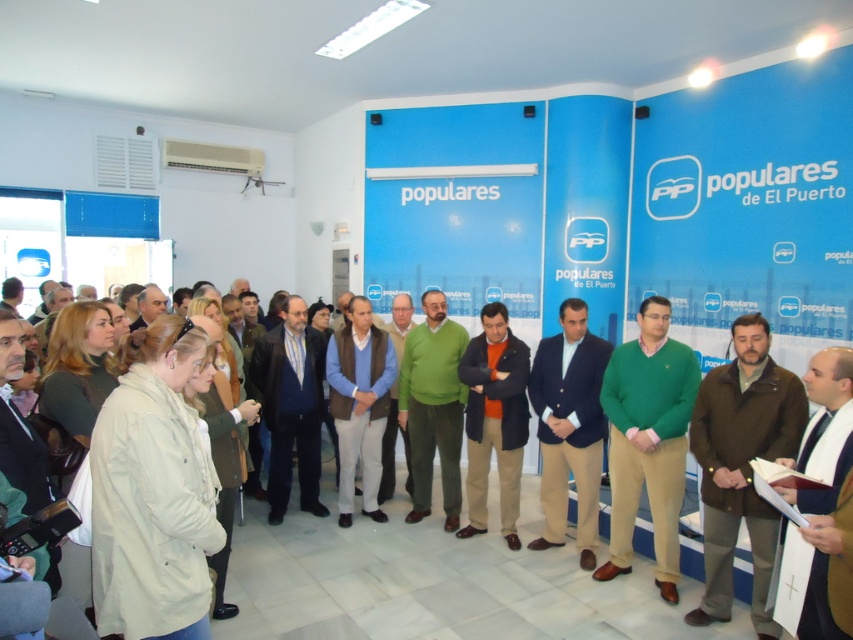
You are standing in the conference room and see two points marked in the scene. Which point, point [722,429] or point [273,444], is closer to you?

Point [722,429] is closer to the viewer than point [273,444].

You are a photographer standing at the left side of the room. You need to take a photo that includes both the brown wool sweater at right and the green sweater at center. Given that your camera has a maximum focus range of 8 feet, will you be able to capture both subjects in focus?

The distance between the brown wool sweater at right and the green sweater at center is 9.33 feet, which exceeds the camera maximum focus range of 8 feet. Therefore, you cannot capture both subjects in focus.